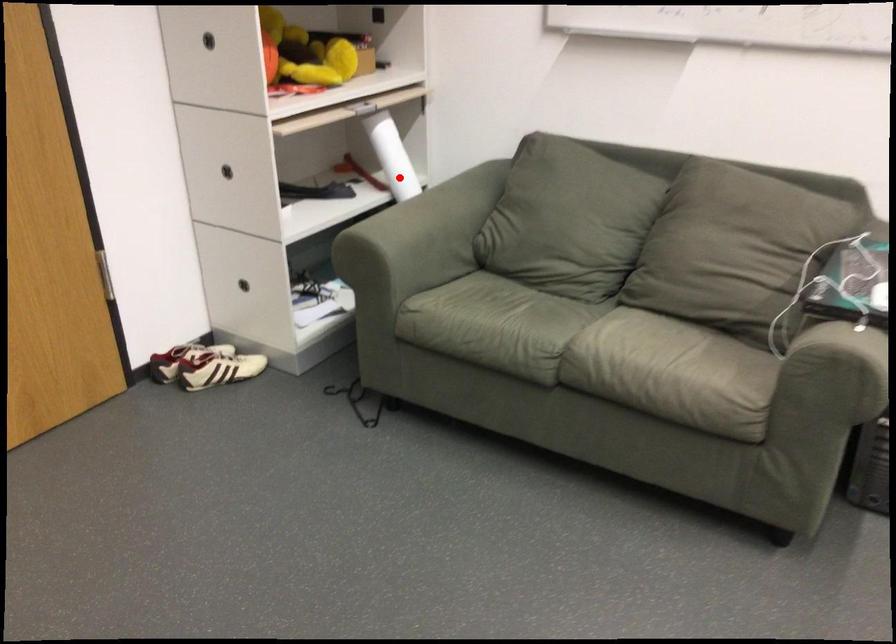
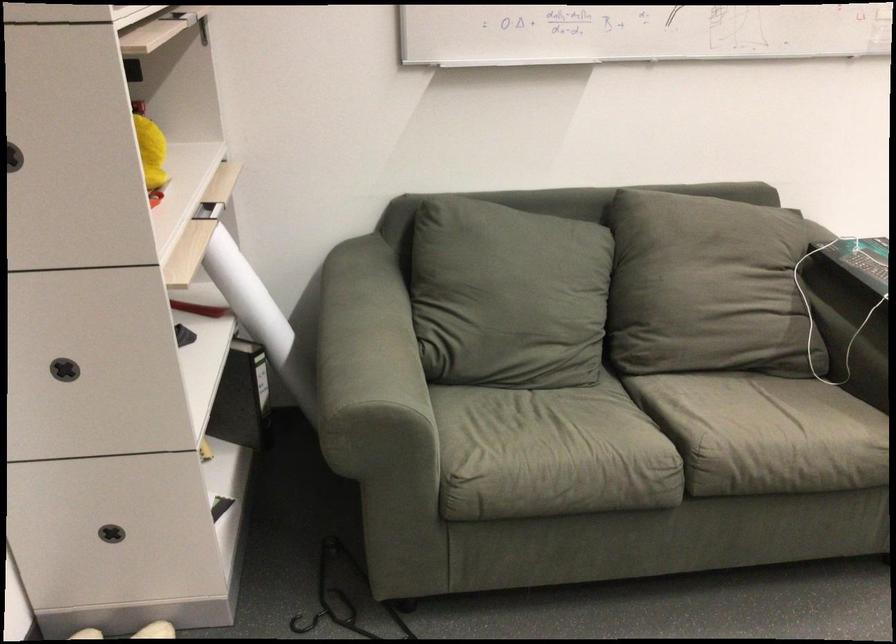
Question: I am providing you with two images of the same scene from different viewpoints. Given a red point in image1, look at the same physical point in image2. Is it:

Choices:
 (A) Closer to the viewpoint
 (B) Farther from the viewpoint

Answer: (A)